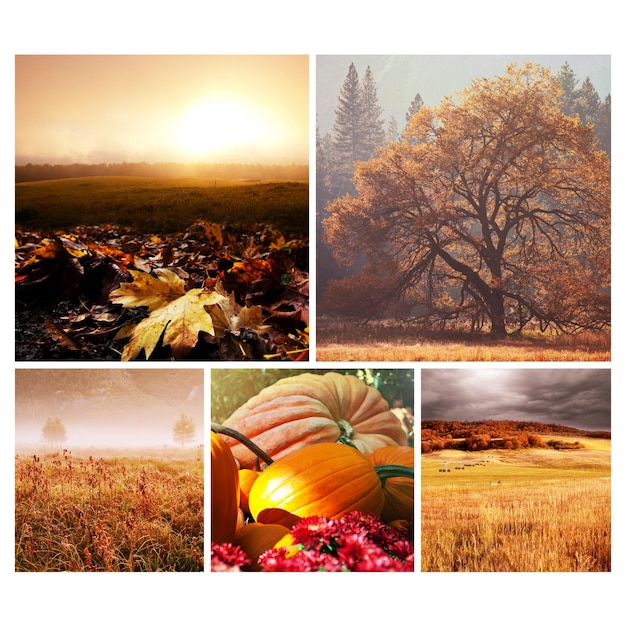
What are the coordinates of `pictures` in the screenshot? It's located at (501, 486), (364, 464), (135, 468), (188, 270), (404, 293).